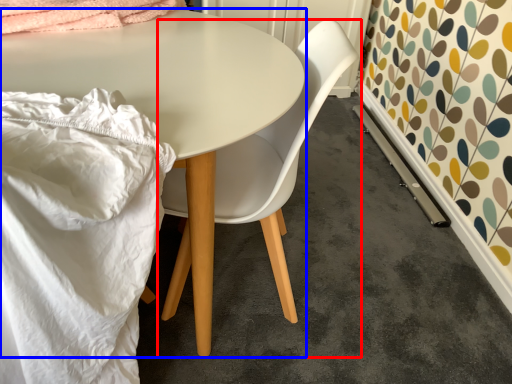
Question: Which object is closer to the camera taking this photo, chair (highlighted by a red box) or table (highlighted by a blue box)?

Choices:
 (A) chair
 (B) table

Answer: (B)